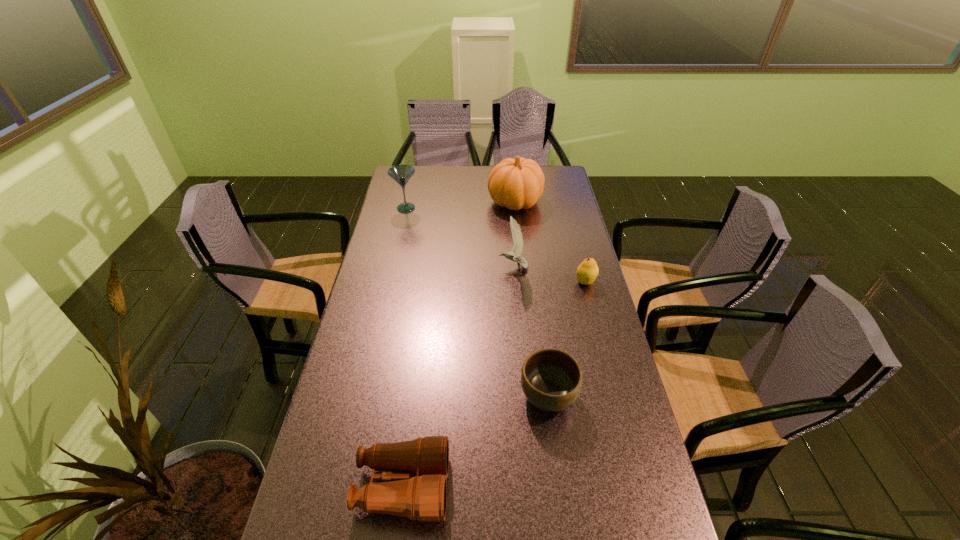
Find the location of `vacant region located 0.320m at the tip of the beak of the third tallest object`. vacant region located 0.320m at the tip of the beak of the third tallest object is located at coordinates click(411, 267).

This screenshot has height=540, width=960. In order to click on vacant position located 0.280m on the left of the bowl in this screenshot , I will do `click(417, 395)`.

Locate an element on the screen. free spot located 0.350m on the back of the pear is located at coordinates (569, 218).

The image size is (960, 540). In order to click on vacant space situated through the lenses of the nearest object in this screenshot , I will do `click(469, 486)`.

Find the location of a particular element. The height and width of the screenshot is (540, 960). object situated at the far edge is located at coordinates click(x=518, y=183).

You are a GUI agent. You are given a task and a screenshot of the screen. Output one action in this format:
    pyautogui.click(x=<x>, y=<y>)
    Task: Click on the martini located in the left edge section of the desktop
    This screenshot has height=540, width=960.
    Given the screenshot: What is the action you would take?
    pyautogui.click(x=401, y=174)

Locate an element on the screen. The width and height of the screenshot is (960, 540). binoculars that is at the left edge is located at coordinates (422, 496).

Where is `pumpkin present at the right edge`? pumpkin present at the right edge is located at coordinates click(518, 183).

Find the location of a particular element. This screenshot has width=960, height=540. bowl present at the right edge is located at coordinates (551, 379).

Identify the location of pear situated at the right edge. (587, 271).